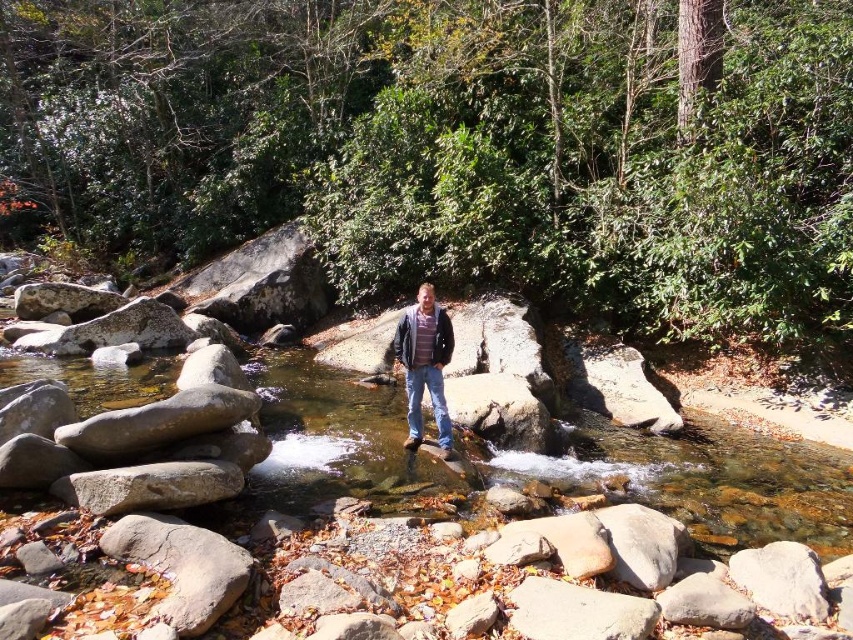
Is clear water stream at center positioned behind striped knit sweater at center?

No, clear water stream at center is in front of striped knit sweater at center.

Which is more to the right, clear water stream at center or striped knit sweater at center?

striped knit sweater at center is more to the right.

Locate an element on the screen. clear water stream at center is located at coordinates [x=705, y=481].